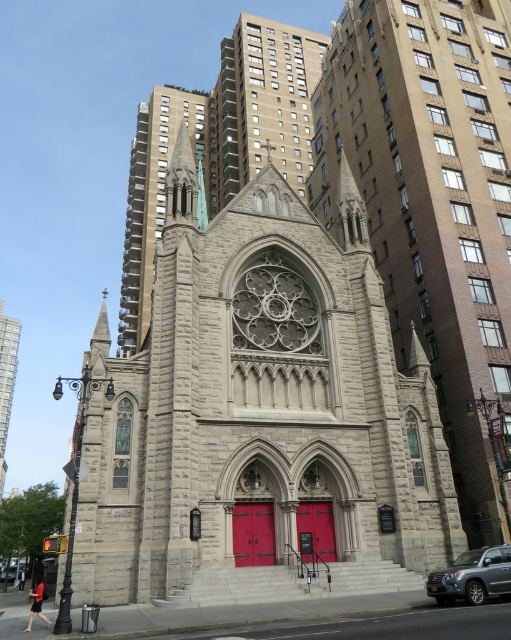
Does silver metallic suv at lower right appear on the left side of matte red door at center?

In fact, silver metallic suv at lower right is to the right of matte red door at center.

Who is higher up, silver metallic suv at lower right or matte red door at center?

matte red door at center is above.

Who is more forward, (434,584) or (256,554)?

Point (434,584)

Where is `silver metallic suv at lower right`? The image size is (511, 640). silver metallic suv at lower right is located at coordinates (x=473, y=577).

Is gray stone tower at center shorter than silver metallic car at lower left?

No.

Which is behind, point (452, 145) or point (18, 564)?

Positioned behind is point (18, 564).

Who is more distant from viewer, [499,344] or [19,563]?

The point [19,563] is behind.

This screenshot has width=511, height=640. Find the location of `gray stone tower at center`. gray stone tower at center is located at coordinates (431, 200).

Can you confirm if matte red door at center is positioned to the left of silver metallic car at lower left?

No, matte red door at center is not to the left of silver metallic car at lower left.

From the picture: Which is below, matte red door at center or silver metallic car at lower left?

silver metallic car at lower left is lower down.

Is point (246, 512) closer to camera compared to point (13, 564)?

Yes, point (246, 512) is closer to viewer.

This screenshot has width=511, height=640. What are the coordinates of `matte red door at center` in the screenshot? It's located at (252, 532).